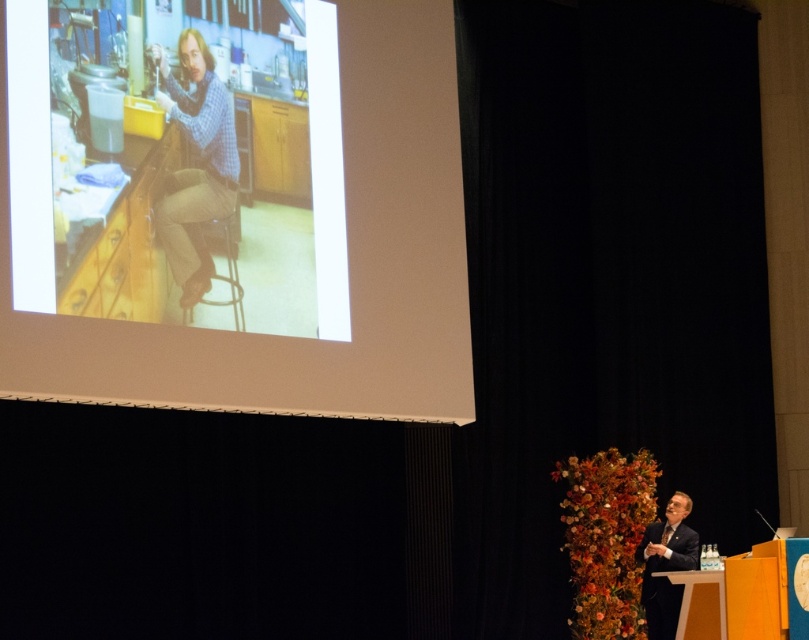
Question: Is white matte projector screen at upper left bigger than dark suit at lower right?

Choices:
 (A) yes
 (B) no

Answer: (B)

Question: Estimate the real-world distances between objects in this image. Which object is farther from the blue checkered shirt at upper left?

Choices:
 (A) white matte projector screen at upper left
 (B) dark suit at lower right

Answer: (B)

Question: Which point is closer to the camera taking this photo?

Choices:
 (A) (689, 506)
 (B) (227, 145)

Answer: (B)

Question: Is blue checkered shirt at upper left below dark suit at lower right?

Choices:
 (A) yes
 (B) no

Answer: (B)

Question: Is white matte projector screen at upper left smaller than dark suit at lower right?

Choices:
 (A) no
 (B) yes

Answer: (B)

Question: Which point is farther to the camera?

Choices:
 (A) dark suit at lower right
 (B) white matte projector screen at upper left
 (C) blue checkered shirt at upper left

Answer: (B)